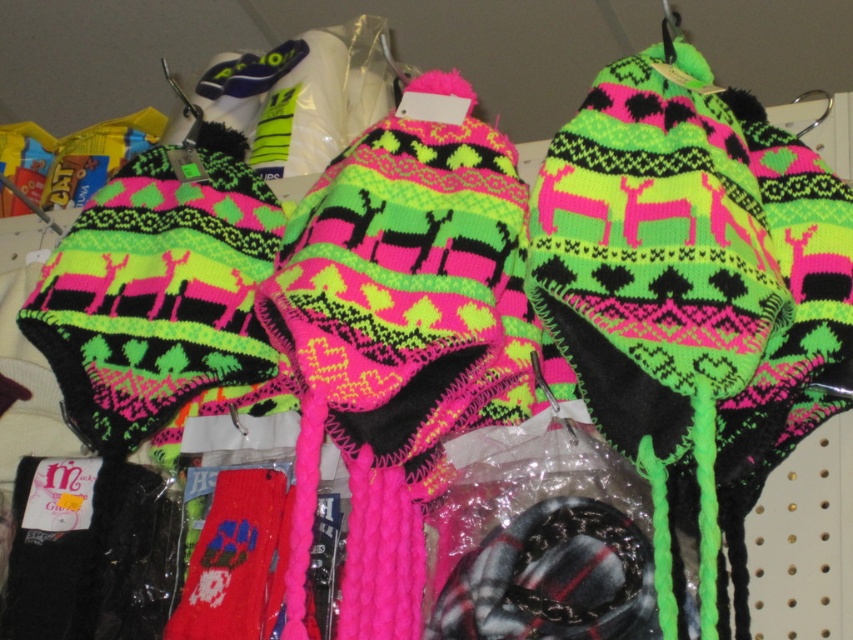
Question: Considering the relative positions of neon pink knitted sock at center and knitted wool socks at center in the image provided, where is neon pink knitted sock at center located with respect to knitted wool socks at center?

Choices:
 (A) below
 (B) above

Answer: (B)

Question: Among these points, which one is nearest to the camera?

Choices:
 (A) (189, 604)
 (B) (392, 474)

Answer: (B)

Question: Which point is farther to the camera?

Choices:
 (A) (258, 561)
 (B) (386, 445)

Answer: (A)

Question: Considering the relative positions of neon pink knitted sock at center and knitted wool socks at center in the image provided, where is neon pink knitted sock at center located with respect to knitted wool socks at center?

Choices:
 (A) above
 (B) below

Answer: (A)

Question: Does neon pink knitted sock at center appear under knitted wool socks at center?

Choices:
 (A) no
 (B) yes

Answer: (A)